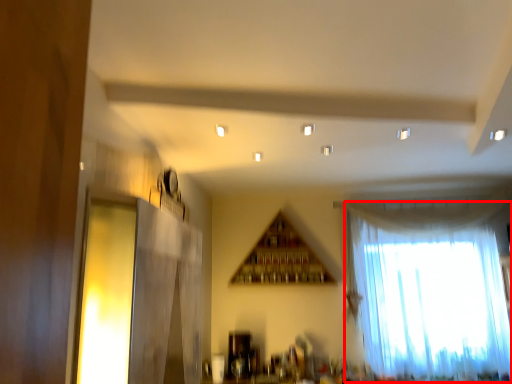
Question: From the image's perspective, considering the relative positions of curtain (annotated by the red box) and window in the image provided, where is curtain (annotated by the red box) located with respect to the staircase?

Choices:
 (A) below
 (B) above

Answer: (A)